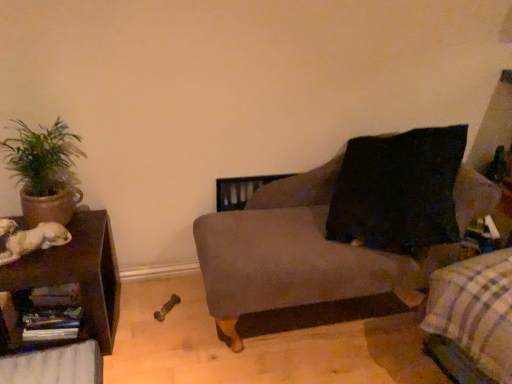
The height and width of the screenshot is (384, 512). I want to click on free point below velvet gray couch at center (from a real-world perspective), so click(325, 320).